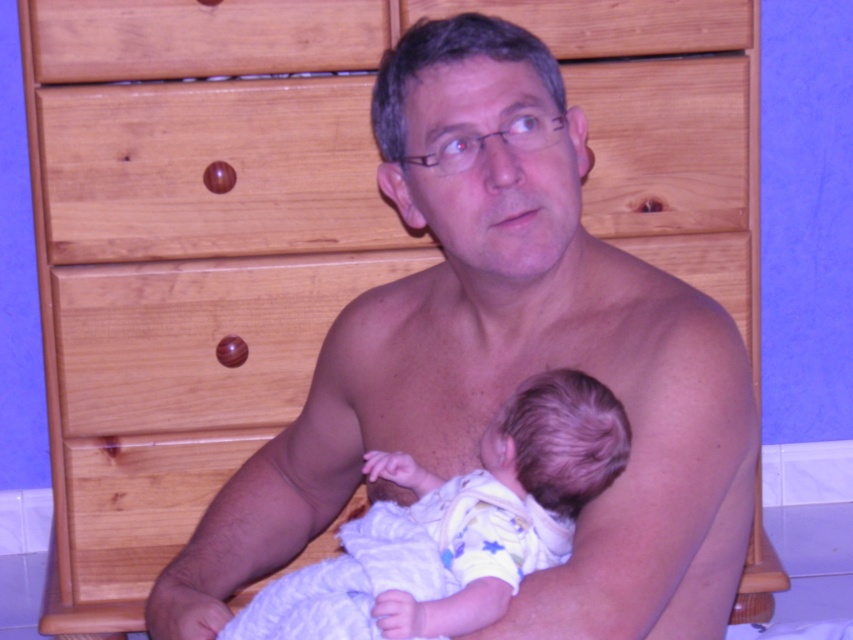
You are a photographer taking a portrait of the smooth skin man at center and the white soft fabric baby at center. Which subject should you focus on if you want to capture the one closer to the camera?

The smooth skin man at center is positioned on the right side of white soft fabric baby at center, so the photographer should focus on the smooth skin man at center since he is closer to the camera.

You are a photographer taking a portrait of the smooth skin man at center and the white soft fabric baby at center. Which subject should you focus on first to ensure both are in sharp focus?

You should focus on the smooth skin man at center first because he is closer to you than the white soft fabric baby at center, so focusing on him first will help ensure both are in focus when using depth of field techniques.

Based on the coordinates provided, which object in the scene is located at point (503, 364)?

The point (503, 364) marks the location of the smooth skin man at center.